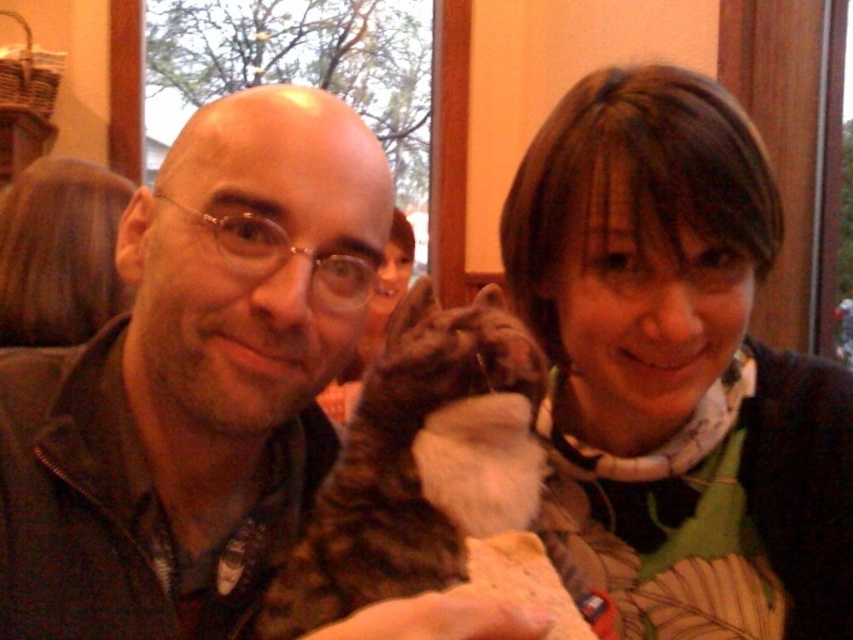
Is matte brown hair at upper right taller than tabby fur cat at center?

Indeed, matte brown hair at upper right has a greater height compared to tabby fur cat at center.

Find the location of a particular element. matte brown hair at upper right is located at coordinates (676, 369).

Does matte black jacket at center come in front of matte brown hair at upper right?

That is True.

Does matte black jacket at center have a lesser height compared to matte brown hair at upper right?

Yes, matte black jacket at center is shorter than matte brown hair at upper right.

Which is in front, point (164, 208) or point (666, 337)?

Point (164, 208) is in front.

At what (x,y) coordinates should I click in order to perform the action: click on matte black jacket at center. Please return your answer as a coordinate pair (x, y). Image resolution: width=853 pixels, height=640 pixels. Looking at the image, I should click on (194, 380).

Does matte brown hair at upper right appear on the left side of blonde hair at upper left?

No, matte brown hair at upper right is not to the left of blonde hair at upper left.

Is point (741, 280) behind point (35, 298)?

No, (741, 280) is in front of (35, 298).

Does point (680, 122) come closer to viewer compared to point (32, 264)?

Yes, point (680, 122) is closer to viewer.

The image size is (853, 640). Identify the location of matte brown hair at upper right. (676, 369).